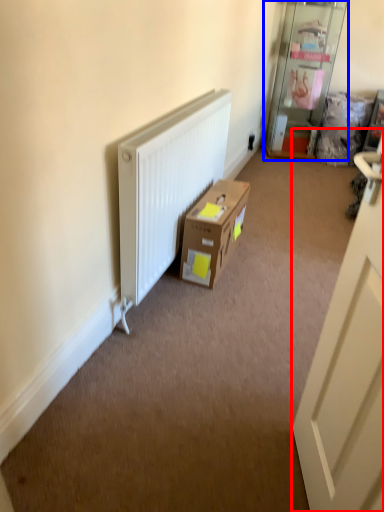
Question: Which object is further to the camera taking this photo, door (highlighted by a red box) or shelf (highlighted by a blue box)?

Choices:
 (A) door
 (B) shelf

Answer: (B)